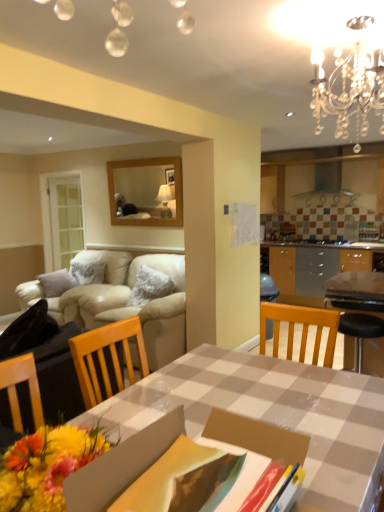
Question: Is point (372, 337) closer or farther from the camera than point (135, 274)?

Choices:
 (A) farther
 (B) closer

Answer: (B)

Question: In terms of width, does checkerboard plastic table at center look wider or thinner when compared to beige leather couch at left?

Choices:
 (A) wide
 (B) thin

Answer: (B)

Question: Which is nearer to the checkered fabric table at center?

Choices:
 (A) crystal chandelier at upper right
 (B) checkerboard plastic table at center
 (C) beige leather couch at left

Answer: (A)

Question: Which of these objects is positioned closest to the crystal chandelier at upper right?

Choices:
 (A) checkerboard plastic table at center
 (B) checkered fabric table at center
 (C) beige leather couch at left

Answer: (B)